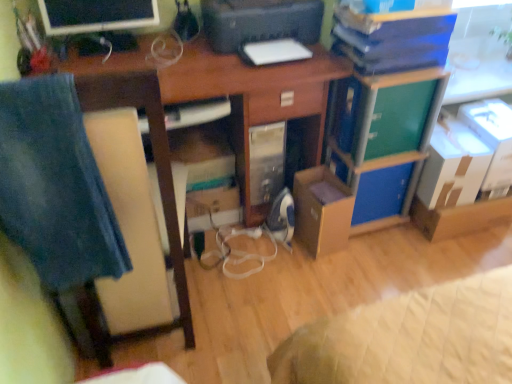
Find the location of a particular element. This screenshot has height=384, width=512. vacant area on top of white cardboard box at upper right, the fourth cardboard box from the left (from a real-world perspective) is located at coordinates (495, 114).